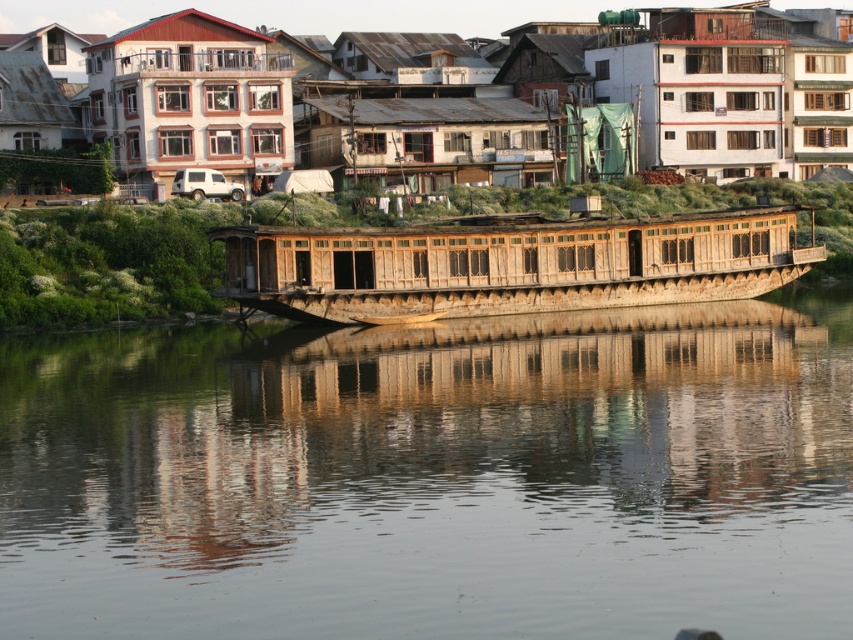
Question: Is smooth brown water at center above wooden houseboat at center?

Choices:
 (A) yes
 (B) no

Answer: (B)

Question: Among these objects, which one is farthest from the camera?

Choices:
 (A) smooth brown water at center
 (B) wooden houseboat at center

Answer: (B)

Question: Which object appears closest to the camera in this image?

Choices:
 (A) wooden houseboat at center
 (B) smooth brown water at center

Answer: (B)

Question: Can you confirm if smooth brown water at center is positioned below wooden houseboat at center?

Choices:
 (A) yes
 (B) no

Answer: (A)

Question: Among these points, which one is nearest to the camera?

Choices:
 (A) (233, 406)
 (B) (618, 221)

Answer: (A)

Question: Is smooth brown water at center to the right of wooden houseboat at center from the viewer's perspective?

Choices:
 (A) no
 (B) yes

Answer: (A)